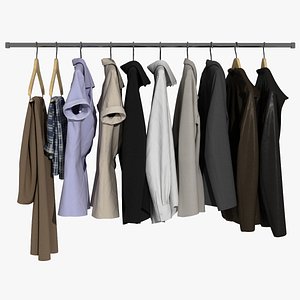
Where is `clothes hanger`? The width and height of the screenshot is (300, 300). clothes hanger is located at coordinates (36, 69), (56, 63), (81, 54), (110, 57), (131, 56), (158, 54), (188, 53), (209, 52), (235, 56), (264, 57).